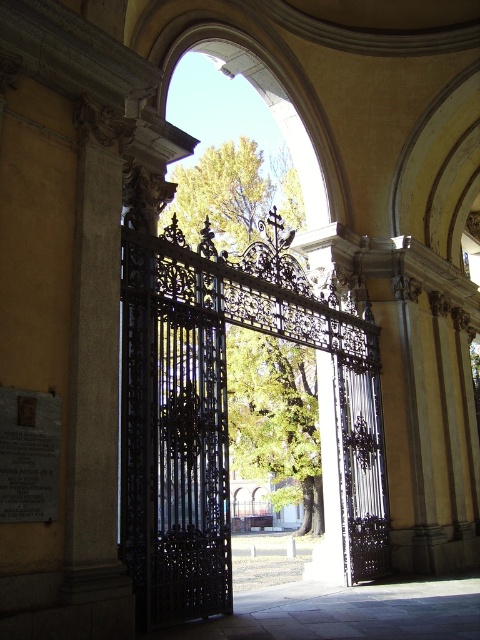
Can you confirm if black wrought iron gate at center is positioned above smooth stone pillar at left?

No.

Can you confirm if black wrought iron gate at center is thinner than smooth stone pillar at left?

In fact, black wrought iron gate at center might be wider than smooth stone pillar at left.

Describe the element at coordinates (225, 412) in the screenshot. This screenshot has width=480, height=640. I see `black wrought iron gate at center` at that location.

The width and height of the screenshot is (480, 640). In order to click on black wrought iron gate at center in this screenshot , I will do `click(225, 412)`.